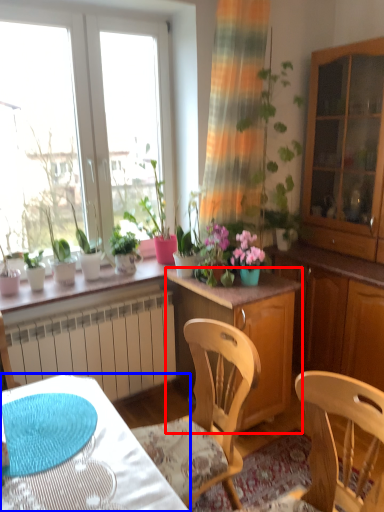
Question: Which of the following is the farthest to the observer, cabinetry (highlighted by a red box) or desk (highlighted by a blue box)?

Choices:
 (A) cabinetry
 (B) desk

Answer: (A)